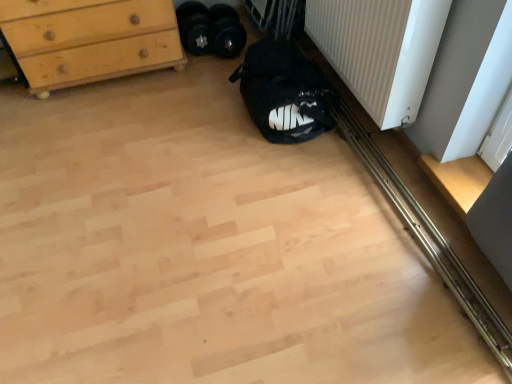
The height and width of the screenshot is (384, 512). In order to click on vacant space in between light wood chest of drawers at upper left and black fabric sleeping bag at lower center in this screenshot , I will do `click(164, 102)`.